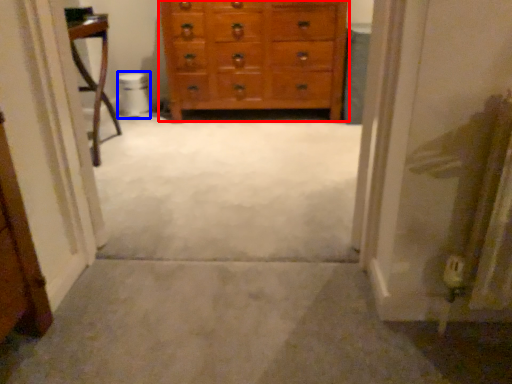
Question: Which object appears farthest to the camera in this image, chest of drawers (highlighted by a red box) or toilet bowl (highlighted by a blue box)?

Choices:
 (A) chest of drawers
 (B) toilet bowl

Answer: (B)